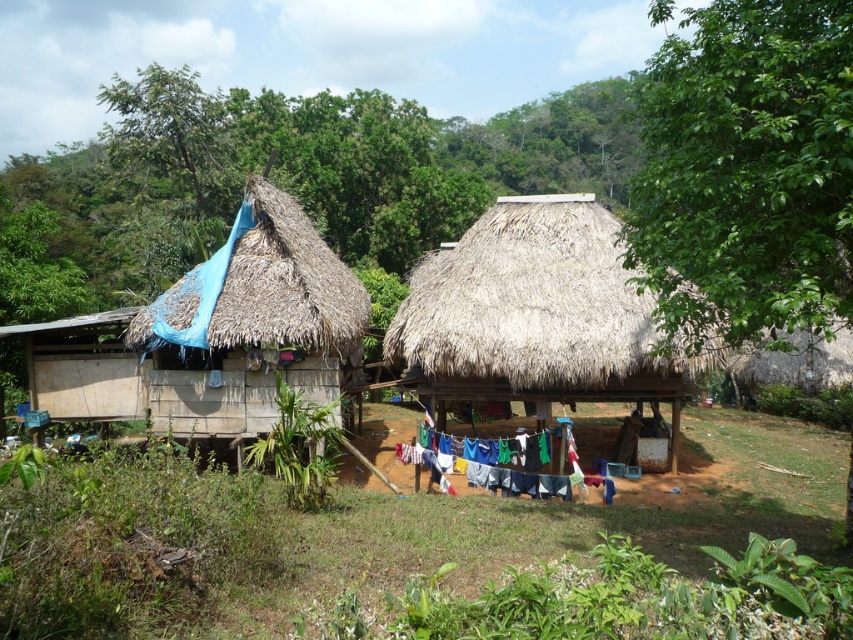
You are standing at the point labeled as point (537, 305) in the image. Which structure are you currently on?

The point (537, 305) is on the brown thatch roof at center, so you are currently on the brown thatch roof at center.

You are a traveler passing by the two huts. You notice the thatched straw roof at left and the multicolored fabric at center. Which object is larger in size?

The multicolored fabric at center is larger than the thatched straw roof at left.

You are a visitor standing between the two huts and want to take a photo of the thatched straw roof at left and the multicolored fabric at center. Which object will appear larger in your photo?

The thatched straw roof at left will appear larger in your photo because it is closer to you than the multicolored fabric at center.